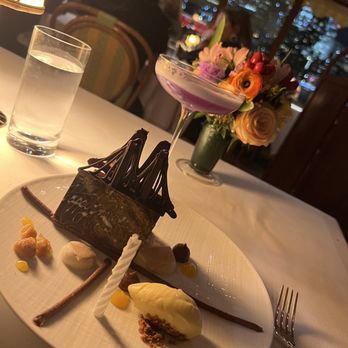
At what (x,y) coordinates should I click in order to perform the action: click on candle. Please return your answer as a coordinate pair (x, y). The image size is (348, 348). Looking at the image, I should click on (117, 273).